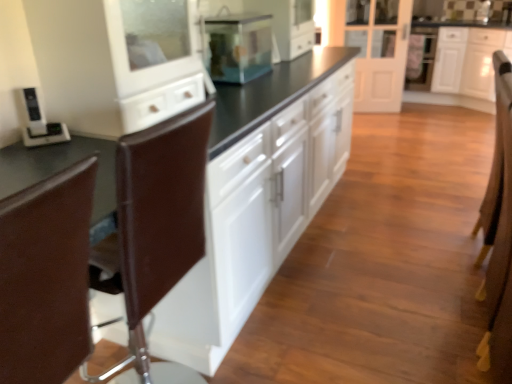
Locate an element on the screen. vacant point to the right of white glossy cabinets at center, the 2th cabinetry from the back is located at coordinates (397, 218).